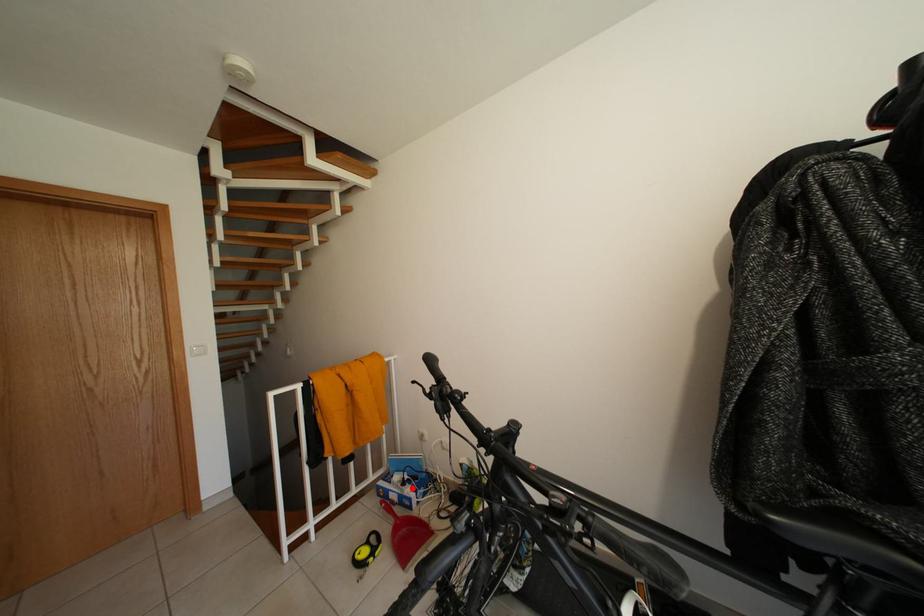
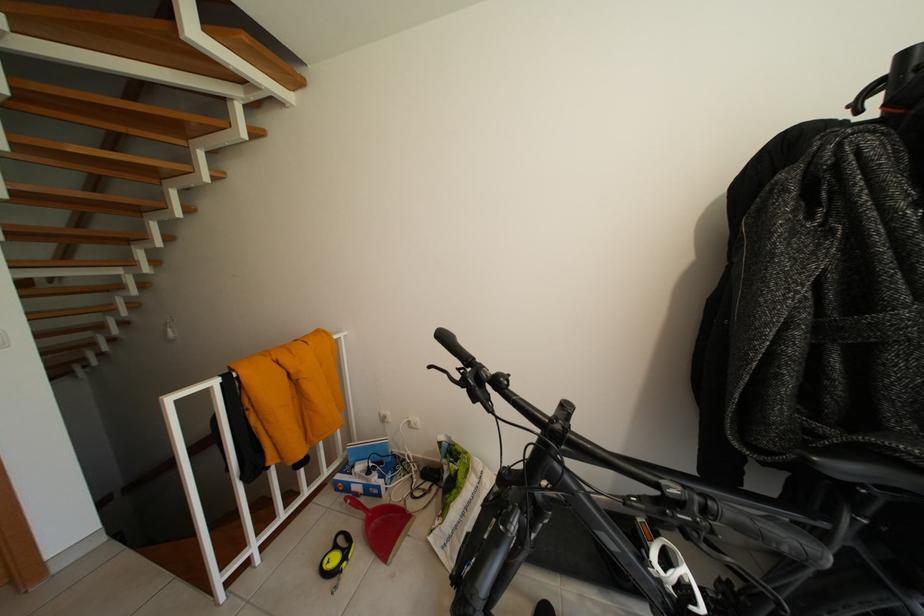
Question: I am providing you with two images of the same scene from different viewpoints. A red point is marked on the first image. At the location where the point appears in image 1, is it still visible in image 2?

Choices:
 (A) Yes
 (B) No

Answer: (A)